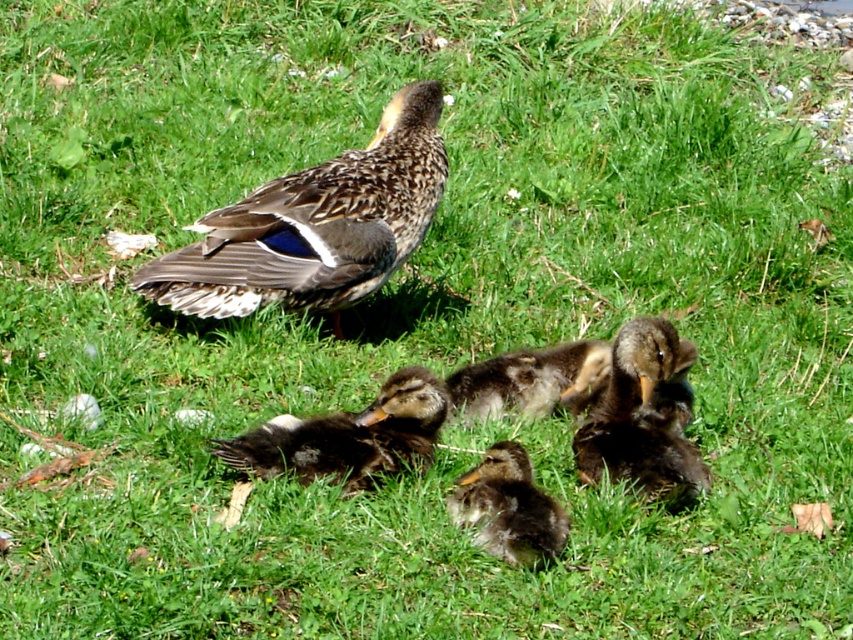
Can you confirm if dark brown fluffy duckling at center is wider than dark brown fuzzy duckling at center?

Yes.

Who is more distant from viewer, (682, 452) or (506, 468)?

The point (682, 452) is behind.

Locate an element on the screen. This screenshot has height=640, width=853. dark brown fluffy duckling at center is located at coordinates (643, 417).

Looking at this image, can you confirm if dark brown fluffy duckling at center is positioned above brown fluffy duckling at center?

No.

Between dark brown fluffy duckling at center and brown fluffy duckling at center, which one is positioned higher?

brown fluffy duckling at center is above.

Locate an element on the screen. The width and height of the screenshot is (853, 640). dark brown fluffy duckling at center is located at coordinates (643, 417).

Locate an element on the screen. Image resolution: width=853 pixels, height=640 pixels. brown speckled duck at upper left is located at coordinates (315, 225).

Which is in front, point (358, 168) or point (624, 458)?

Point (624, 458) is more forward.

Describe the element at coordinates (315, 225) in the screenshot. The image size is (853, 640). I see `brown speckled duck at upper left` at that location.

You are a GUI agent. You are given a task and a screenshot of the screen. Output one action in this format:
    pyautogui.click(x=<x>, y=<y>)
    Task: Click on the brown speckled duck at upper left
    Image resolution: width=853 pixels, height=640 pixels.
    Given the screenshot: What is the action you would take?
    pyautogui.click(x=315, y=225)